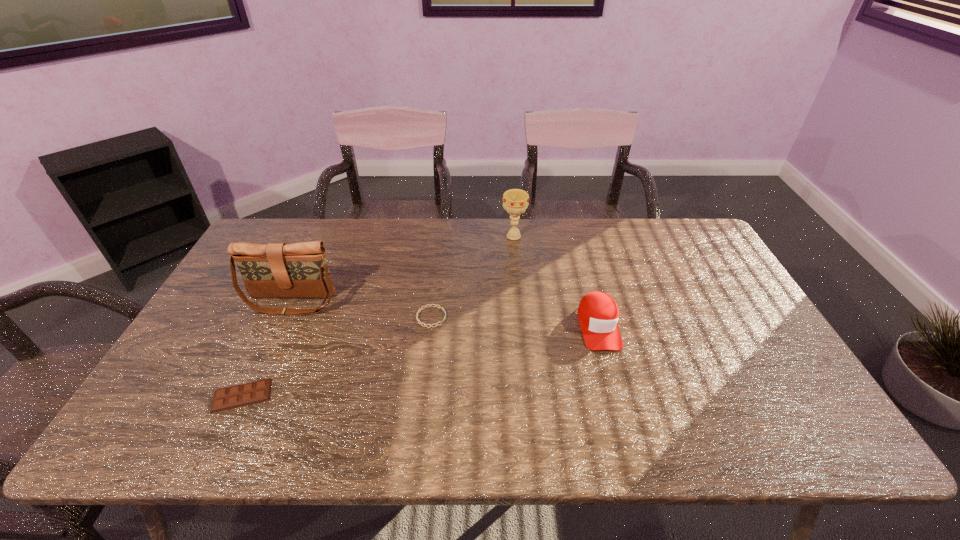
Where is `free spot located 0.140m on the left of the chocolate bar`? Image resolution: width=960 pixels, height=540 pixels. free spot located 0.140m on the left of the chocolate bar is located at coordinates (153, 395).

At what (x,y) coordinates should I click in order to perform the action: click on free spot located 0.230m on the surface of the bracelet showing star-shaped elements. Please return your answer as a coordinate pair (x, y). Looking at the image, I should click on (528, 317).

Locate an element on the screen. object that is at the far edge is located at coordinates (515, 201).

Find the location of a particular element. object located in the near edge section of the desktop is located at coordinates (236, 396).

Identify the location of shoulder bag present at the left edge. (276, 270).

Find the location of `chocolate bar that is at the left edge`. chocolate bar that is at the left edge is located at coordinates (236, 396).

Image resolution: width=960 pixels, height=540 pixels. In order to click on object located at the near left corner in this screenshot , I will do `click(236, 396)`.

Locate an element on the screen. This screenshot has height=540, width=960. free spot at the far edge of the desktop is located at coordinates (620, 230).

The width and height of the screenshot is (960, 540). I want to click on vacant space at the near edge of the desktop, so click(753, 432).

At what (x,y) coordinates should I click in order to perform the action: click on free location at the left edge. Please return your answer as a coordinate pair (x, y). Looking at the image, I should click on (231, 338).